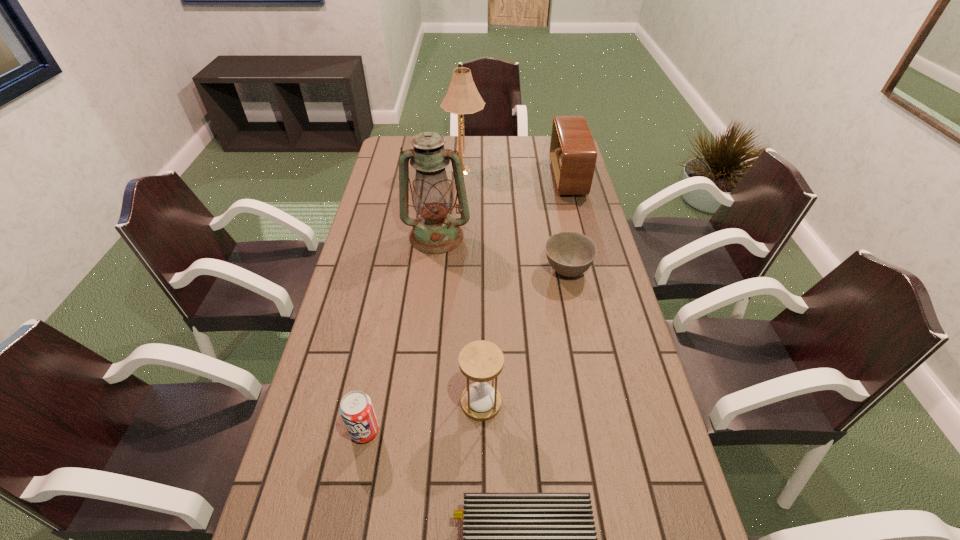
Where is `free spot between the oil lamp and the radio receiver`? free spot between the oil lamp and the radio receiver is located at coordinates (502, 207).

At what (x,y) coordinates should I click in order to perform the action: click on object that can be found as the sixth closest to the radio receiver. Please return your answer as a coordinate pair (x, y). This screenshot has width=960, height=540. Looking at the image, I should click on (509, 539).

You are a GUI agent. You are given a task and a screenshot of the screen. Output one action in this format:
    pyautogui.click(x=<x>, y=<y>)
    Task: Click on the closest object to the lampshade
    The height and width of the screenshot is (540, 960).
    Given the screenshot: What is the action you would take?
    pyautogui.click(x=434, y=232)

Locate an element on the screen. vacant region that satisfies the following two spatial constraints: 1. on the front-facing side of the radio receiver; 2. on the front side of the bowl is located at coordinates (590, 269).

Find the location of `vacant space that satisfies the following two spatial constraints: 1. on the front-facing side of the radio receiver; 2. on the front side of the hourglass`. vacant space that satisfies the following two spatial constraints: 1. on the front-facing side of the radio receiver; 2. on the front side of the hourglass is located at coordinates (624, 403).